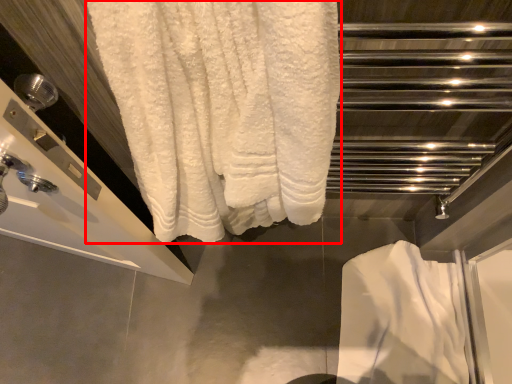
Question: In this image, where is towel (annotated by the red box) located relative to bath towel?

Choices:
 (A) left
 (B) right

Answer: (A)